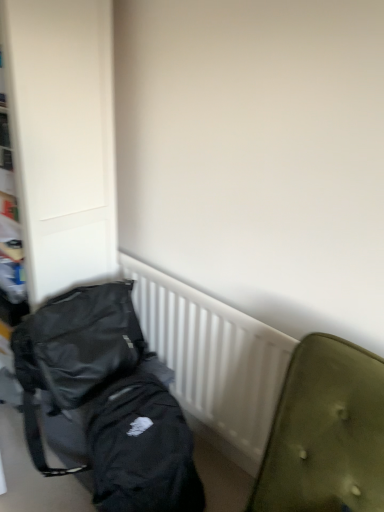
Where is `white plastic radiator at center`? Image resolution: width=384 pixels, height=512 pixels. white plastic radiator at center is located at coordinates (213, 361).

This screenshot has width=384, height=512. Describe the element at coordinates (75, 352) in the screenshot. I see `black matte backpack at lower left` at that location.

Locate an element on the screen. white plastic radiator at center is located at coordinates (213, 361).

Would you say white plastic radiator at center is to the left or to the right of black fabric backpack at left in the picture?

Clearly, white plastic radiator at center is on the right of black fabric backpack at left in the image.

Who is shorter, white plastic radiator at center or black fabric backpack at left?

Standing shorter between the two is white plastic radiator at center.

Is the surface of white plastic radiator at center in direct contact with black fabric backpack at left?

No, white plastic radiator at center is not with black fabric backpack at left.

Is black fabric backpack at left inside white plastic radiator at center?

No, black fabric backpack at left is located outside of white plastic radiator at center.

Is black fabric backpack at left shorter than white plastic radiator at center?

In fact, black fabric backpack at left may be taller than white plastic radiator at center.

Considering the sizes of black fabric backpack at left and white plastic radiator at center in the image, is black fabric backpack at left wider or thinner than white plastic radiator at center?

In the image, black fabric backpack at left appears to be wider than white plastic radiator at center.

Can you confirm if black fabric backpack at left is positioned to the left of white plastic radiator at center?

Yes, black fabric backpack at left is to the left of white plastic radiator at center.

Does point (114, 231) appear closer or farther from the camera than point (220, 342)?

Point (114, 231) appears to be farther away from the viewer than point (220, 342).

How much distance is there between black fabric backpack at left and black matte backpack at lower left?

The distance of black fabric backpack at left from black matte backpack at lower left is 13.75 inches.

Consider the image. Between black fabric backpack at left and black matte backpack at lower left, which one has larger width?

black fabric backpack at left.

Which is correct: black fabric backpack at left is inside black matte backpack at lower left, or outside of it?

black fabric backpack at left is not inside black matte backpack at lower left, it's outside.

Which is correct: white plastic radiator at center is inside black matte backpack at lower left, or outside of it?

white plastic radiator at center is not enclosed by black matte backpack at lower left.

From the image's perspective, which is below, white plastic radiator at center or black matte backpack at lower left?

white plastic radiator at center appears lower in the image.

From a real-world perspective, which object rests below the other?

From a 3D spatial view, white plastic radiator at center is below.

Image resolution: width=384 pixels, height=512 pixels. Find the location of `backpack that is above the white plastic radiator at center (from the image's perspective)`. backpack that is above the white plastic radiator at center (from the image's perspective) is located at coordinates click(75, 352).

Is black matte backpack at lower left further to the viewer compared to black fabric backpack at left?

Yes.

Can you confirm if black matte backpack at lower left is shorter than black fabric backpack at left?

Yes, black matte backpack at lower left is shorter than black fabric backpack at left.

Is black matte backpack at lower left far from black fabric backpack at left?

That's not correct — black matte backpack at lower left is a little close to black fabric backpack at left.

From the image's perspective, is black matte backpack at lower left located above or below white plastic radiator at center?

From the image's perspective, black matte backpack at lower left appears above white plastic radiator at center.

Which object is further away from the camera, black matte backpack at lower left or white plastic radiator at center?

white plastic radiator at center is behind.

Who is bigger, black matte backpack at lower left or white plastic radiator at center?

With larger size is black matte backpack at lower left.

Considering the relative sizes of black matte backpack at lower left and white plastic radiator at center in the image provided, is black matte backpack at lower left taller than white plastic radiator at center?

No, black matte backpack at lower left is not taller than white plastic radiator at center.

At what (x,y) coordinates should I click in order to perform the action: click on dresser that appears on the left of white plastic radiator at center. Please return your answer as a coordinate pair (x, y). The height and width of the screenshot is (512, 384). Looking at the image, I should click on (62, 138).

In the image, there is a black fabric backpack at left. Where is `radiator below it (from the image's perspective)`? The height and width of the screenshot is (512, 384). radiator below it (from the image's perspective) is located at coordinates (213, 361).

Considering their positions, is black matte backpack at lower left positioned further to black fabric backpack at left than white plastic radiator at center?

white plastic radiator at center.

Based on their spatial positions, is black fabric backpack at left or white plastic radiator at center further from black matte backpack at lower left?

black fabric backpack at left lies further to black matte backpack at lower left than the other object.

When comparing their distances from white plastic radiator at center, does black matte backpack at lower left or black fabric backpack at left seem closer?

black matte backpack at lower left.

Looking at the image, which one is located closer to white plastic radiator at center, black fabric backpack at left or black matte backpack at lower left?

black matte backpack at lower left is positioned closer to the anchor white plastic radiator at center.

From the image, which object appears to be nearer to black matte backpack at lower left, white plastic radiator at center or black fabric backpack at left?

The object closer to black matte backpack at lower left is white plastic radiator at center.

Which object lies nearer to the anchor point black fabric backpack at left, white plastic radiator at center or black matte backpack at lower left?

black matte backpack at lower left.

Image resolution: width=384 pixels, height=512 pixels. Identify the location of backpack between black fabric backpack at left and white plastic radiator at center from top to bottom. (75, 352).